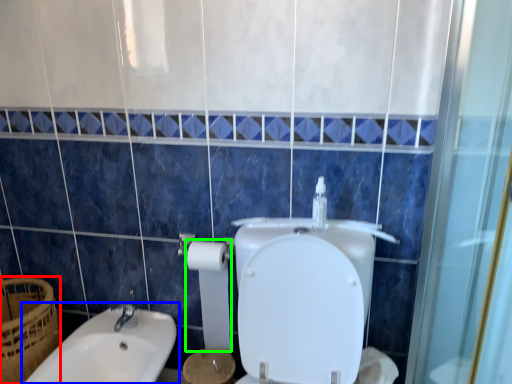
Question: Which object is positioned closest to basket (highlighted by a red box)? Select from sink (highlighted by a blue box) and toilet paper (highlighted by a green box).

Choices:
 (A) sink
 (B) toilet paper

Answer: (A)